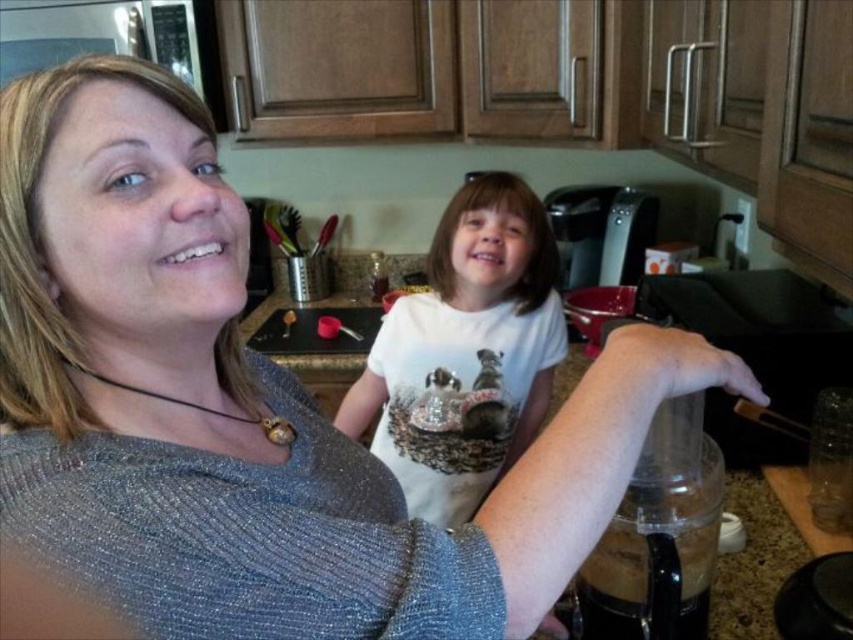
Question: Which of the following is the farthest from the observer?

Choices:
 (A) granite countertop at center
 (B) white cotton shirt at center

Answer: (B)

Question: Can you confirm if white cotton shirt at center is positioned to the left of granite countertop at center?

Choices:
 (A) yes
 (B) no

Answer: (A)

Question: Can you confirm if white cotton shirt at center is positioned to the right of granite countertop at center?

Choices:
 (A) yes
 (B) no

Answer: (B)

Question: Can you confirm if white cotton shirt at center is positioned to the right of granite countertop at center?

Choices:
 (A) no
 (B) yes

Answer: (A)